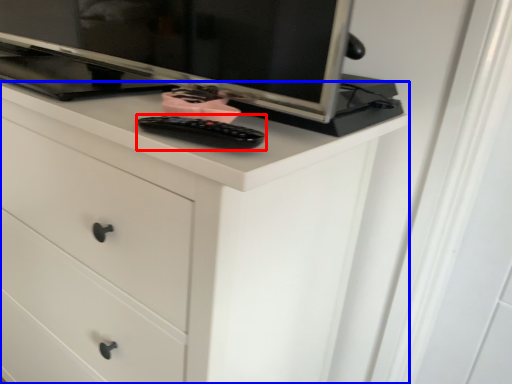
Question: Among these objects, which one is farthest to the camera, control (highlighted by a red box) or chest of drawers (highlighted by a blue box)?

Choices:
 (A) control
 (B) chest of drawers

Answer: (A)